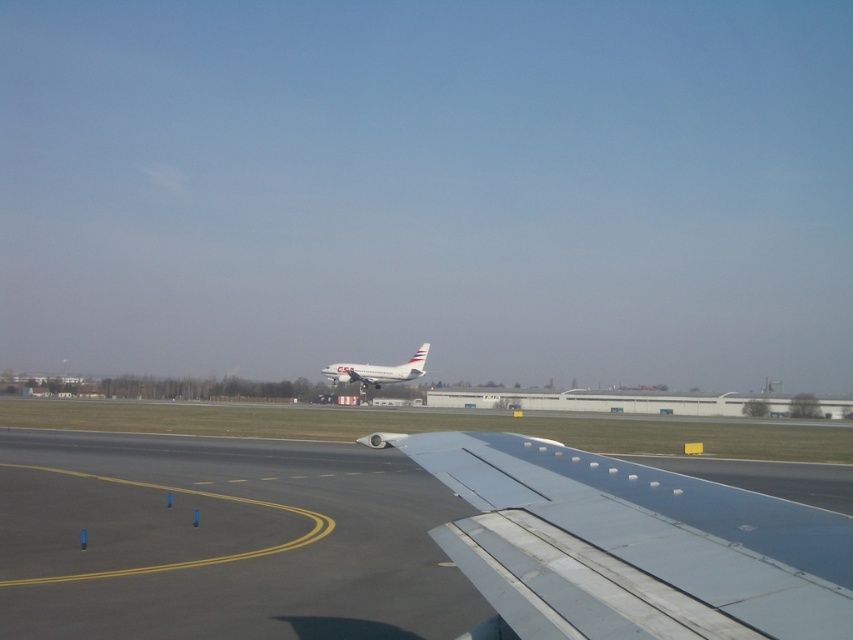
Question: Which object is closer to the camera taking this photo?

Choices:
 (A) smooth asphalt tarmac at lower center
 (B) white matte airplane at center

Answer: (A)

Question: Is the position of smooth asphalt tarmac at lower center less distant than that of white matte airplane at center?

Choices:
 (A) no
 (B) yes

Answer: (B)

Question: Can you confirm if smooth asphalt tarmac at lower center is positioned to the right of white matte airplane at center?

Choices:
 (A) no
 (B) yes

Answer: (B)

Question: Does smooth asphalt tarmac at lower center have a lesser width compared to white matte airplane at center?

Choices:
 (A) no
 (B) yes

Answer: (A)